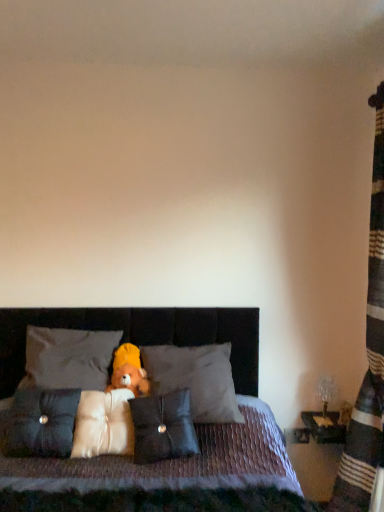
Question: From the image's perspective, is striped fabric curtain at right positioned above or below soft plush teddy bear at center?

Choices:
 (A) above
 (B) below

Answer: (A)

Question: Considering the positions of striped fabric curtain at right and soft plush teddy bear at center in the image, is striped fabric curtain at right taller or shorter than soft plush teddy bear at center?

Choices:
 (A) short
 (B) tall

Answer: (B)

Question: Which object is positioned closest to the white fabric pillow at center, the second pillow from the left?

Choices:
 (A) dark gray fabric pillow at center, placed as the first pillow when sorted from right to left
 (B) satin black pillow at center, acting as the fifth pillow starting from the right
 (C) black leather pillow at center, the fourth pillow when ordered from left to right
 (D) soft plush teddy bear at center
 (E) striped fabric curtain at right

Answer: (B)

Question: Estimate the real-world distances between objects in this image. Which object is closer to the soft plush teddy bear at center?

Choices:
 (A) striped fabric curtain at right
 (B) white fabric pillow at center, the second pillow from the left
 (C) black leather pillow at center, acting as the second pillow starting from the right
 (D) velvet-like brown bed at center
 (E) white soft pillow at center, arranged as the 3th pillow when viewed from the left

Answer: (B)